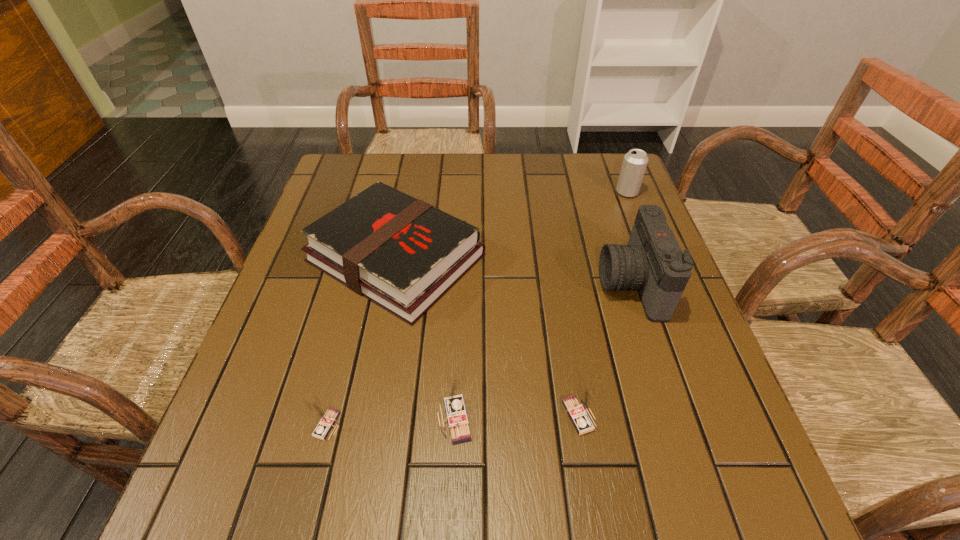
The image size is (960, 540). What are the coordinates of `object that is at the near left corner` in the screenshot? It's located at (326, 417).

Find the location of a particular element. The width and height of the screenshot is (960, 540). object present at the far right corner is located at coordinates (634, 164).

I want to click on free location at the far edge of the desktop, so click(x=562, y=199).

Identify the location of vacant space at the left edge. This screenshot has width=960, height=540. (295, 270).

Where is `vacant area at the right edge of the desktop`? The image size is (960, 540). vacant area at the right edge of the desktop is located at coordinates (615, 234).

In the image, there is a desktop. Identify the location of vacant space at the far left corner. (350, 176).

The height and width of the screenshot is (540, 960). In order to click on vacant space in between the second matchbox from left to right and the fourth object from left to right in this screenshot , I will do `click(516, 418)`.

What are the coordinates of `free spot between the beer can and the second tallest matchbox` in the screenshot? It's located at (603, 304).

The height and width of the screenshot is (540, 960). What are the coordinates of `free space between the camera and the second matchbox from right to left` in the screenshot? It's located at (542, 352).

Where is `vacant area that lies between the hardback book and the camera`? vacant area that lies between the hardback book and the camera is located at coordinates (514, 271).